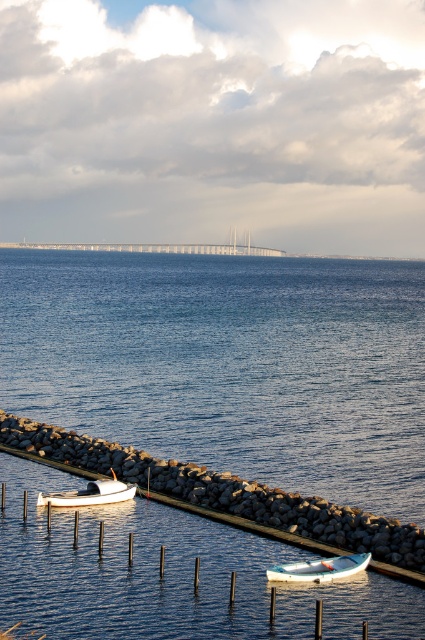
Question: Can you confirm if blue water at center is positioned above gray rock wall at lower left?

Choices:
 (A) yes
 (B) no

Answer: (A)

Question: Can you confirm if blue water at center is positioned above white matte boat at lower center?

Choices:
 (A) yes
 (B) no

Answer: (A)

Question: Is white matte boat at lower center to the right of white matte boat at lower left from the viewer's perspective?

Choices:
 (A) no
 (B) yes

Answer: (B)

Question: Among these points, which one is farthest from the camera?

Choices:
 (A) (118, 483)
 (B) (102, 384)
 (C) (309, 570)

Answer: (B)

Question: Based on their relative distances, which object is farther from the white matte boat at lower left?

Choices:
 (A) blue water at center
 (B) white matte boat at lower center

Answer: (A)

Question: Estimate the real-world distances between objects in this image. Which object is farther from the blue water at center?

Choices:
 (A) white matte boat at lower left
 (B) gray rock wall at lower left
 (C) white matte boat at lower center

Answer: (B)